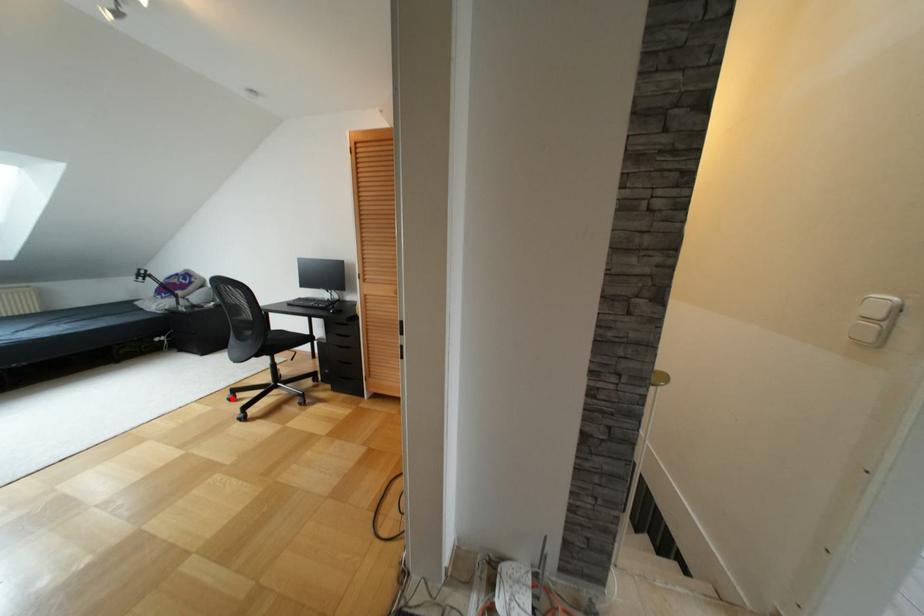
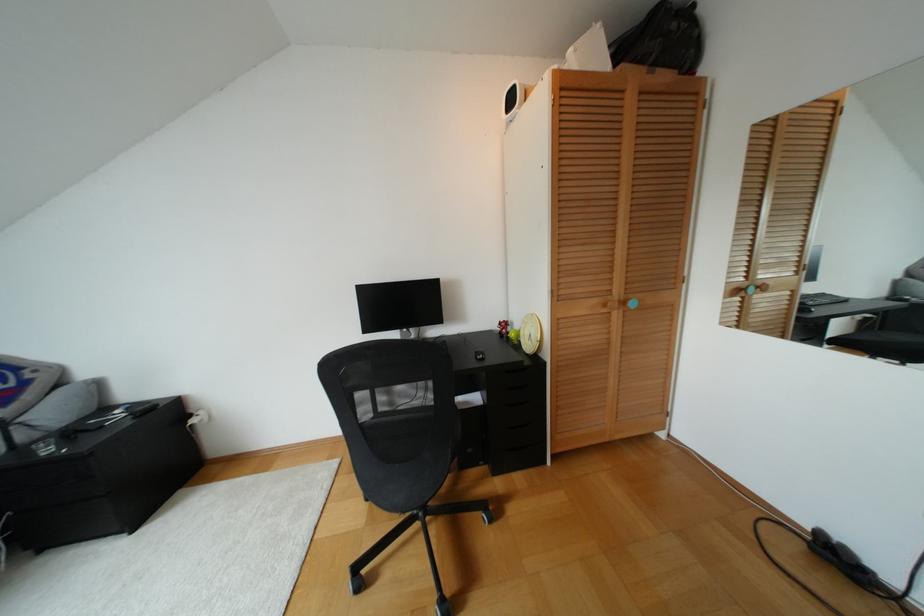
Find the pixel in the second image that matches the highlighted location in the first image.

(359, 585)